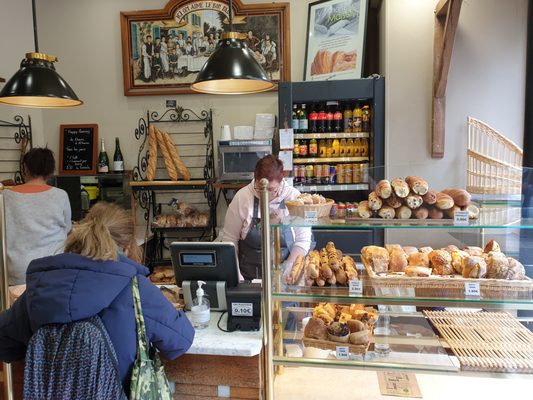
Where is `framed chalkboard`? The height and width of the screenshot is (400, 533). framed chalkboard is located at coordinates (86, 154).